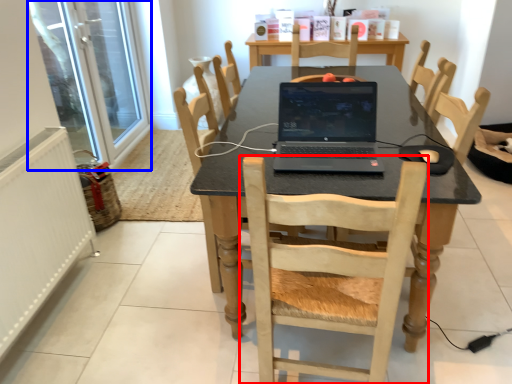
Question: Which object is closer to the camera taking this photo, chair (highlighted by a red box) or screen door (highlighted by a blue box)?

Choices:
 (A) chair
 (B) screen door

Answer: (A)